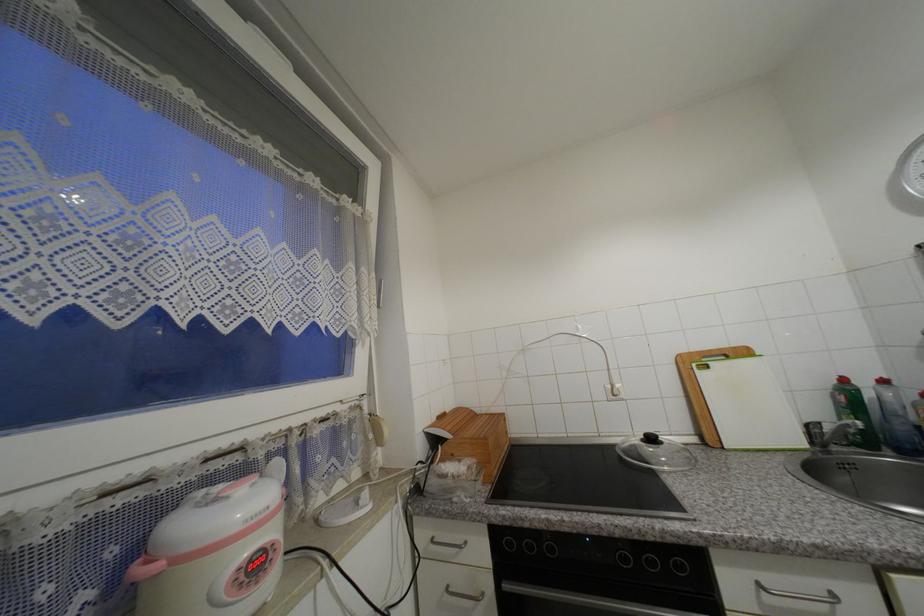
What do you see at coordinates (637, 578) in the screenshot? I see `the black oven knob` at bounding box center [637, 578].